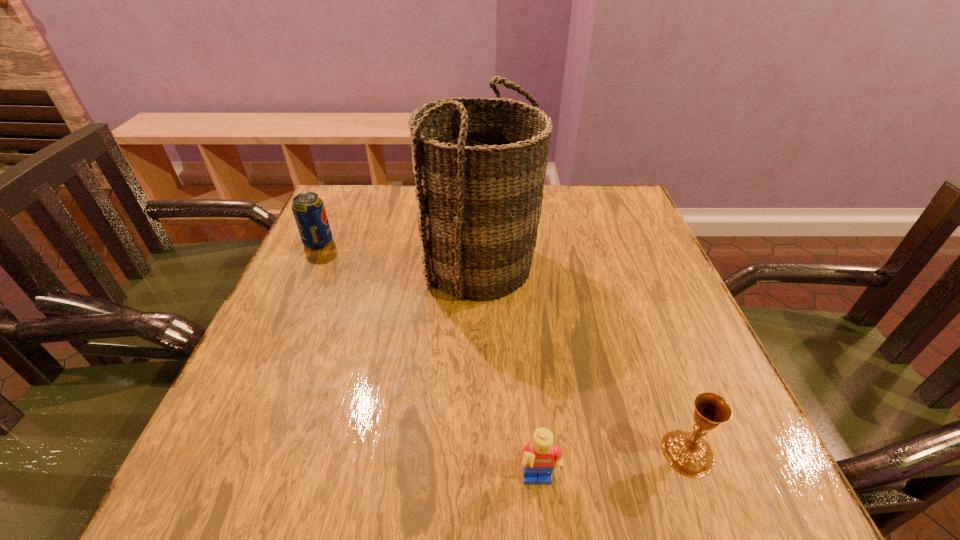
The width and height of the screenshot is (960, 540). I want to click on the tallest object, so click(479, 184).

Locate an element on the screen. Image resolution: width=960 pixels, height=540 pixels. soda is located at coordinates (308, 209).

Locate an element on the screen. the rightmost object is located at coordinates (688, 453).

At what (x,y) coordinates should I click in order to perform the action: click on Lego. Please return your answer as a coordinate pair (x, y). The image size is (960, 540). Looking at the image, I should click on (539, 458).

You are a GUI agent. You are given a task and a screenshot of the screen. Output one action in this format:
    pyautogui.click(x=<x>, y=<y>)
    Task: Click on the free space located 0.330m on the front of the tallest object
    Image resolution: width=960 pixels, height=540 pixels.
    Given the screenshot: What is the action you would take?
    coord(479,458)

At what (x,y) coordinates should I click in order to perform the action: click on vacant space situated 0.230m on the back of the soda. Please return your answer as a coordinate pair (x, y). The image size is (960, 540). Looking at the image, I should click on (343, 188).

Find the location of a particular element. This screenshot has width=960, height=540. free point located 0.180m on the left of the chalice is located at coordinates (546, 453).

Identify the location of object that is at the far edge. Image resolution: width=960 pixels, height=540 pixels. (479, 184).

Identify the location of chalice that is positioned at the near edge. The image size is (960, 540). (688, 453).

This screenshot has width=960, height=540. I want to click on Lego that is at the near edge, so click(539, 458).